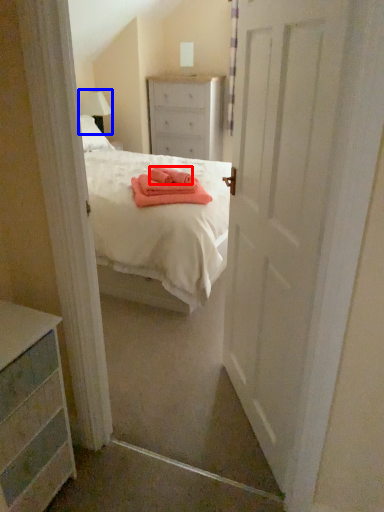
Question: Which point is further to the camera, cloth (highlighted by a red box) or lamp (highlighted by a blue box)?

Choices:
 (A) cloth
 (B) lamp

Answer: (B)